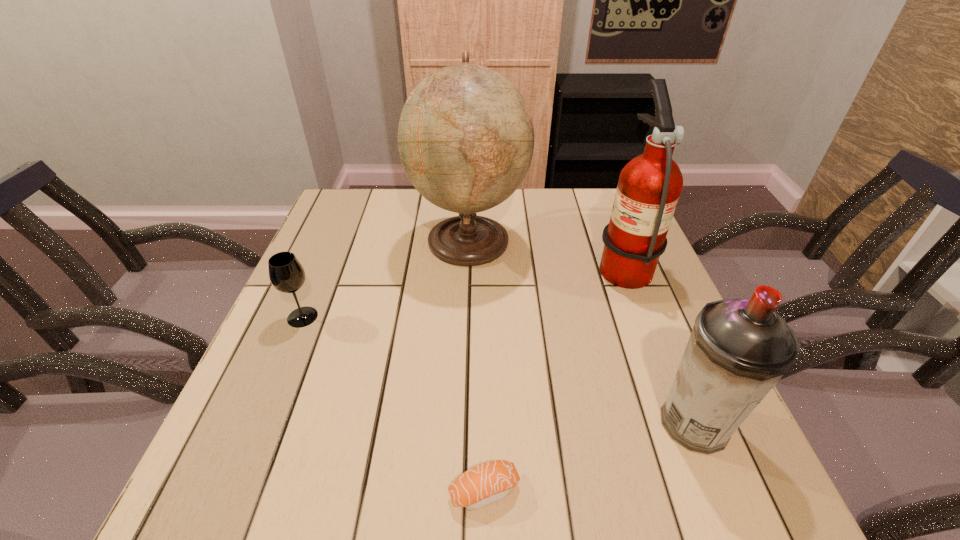
This screenshot has width=960, height=540. Find the location of `vacant space that satisfies the following two spatial constraints: 1. on the nozzle and handle of the fire extinguisher; 2. on the left side of the third tallest object`. vacant space that satisfies the following two spatial constraints: 1. on the nozzle and handle of the fire extinguisher; 2. on the left side of the third tallest object is located at coordinates (684, 424).

Find the location of a particular element. The height and width of the screenshot is (540, 960). free spot that satisfies the following two spatial constraints: 1. on the front-facing side of the nearest object; 2. on the left side of the globe is located at coordinates [460, 491].